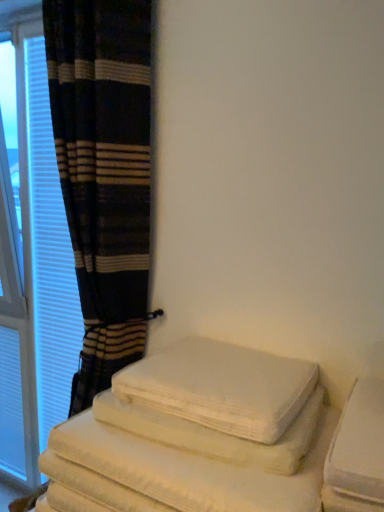
The height and width of the screenshot is (512, 384). I want to click on plaid fabric curtain at left, so click(x=104, y=173).

What is the approximate height of white cotton bath towel at lower right?

white cotton bath towel at lower right is 5.33 inches tall.

Locate an element on the screen. This screenshot has height=512, width=384. white soft towels at lower left is located at coordinates (216, 437).

Find the location of a particular element. This screenshot has width=384, height=512. white textured curtain at left is located at coordinates (34, 274).

Considering the relative positions of white soft towels at lower left and white textured curtain at left in the image provided, is white soft towels at lower left to the left or to the right of white textured curtain at left?

In the image, white soft towels at lower left appears on the right side of white textured curtain at left.

Which is more distant, (84, 443) or (34, 56)?

The point (34, 56) is farther from the camera.

Can we say white soft towels at lower left lies outside white textured curtain at left?

white soft towels at lower left is positioned outside white textured curtain at left.

Considering the relative positions of white soft towels at lower left and white textured curtain at left in the image provided, is white soft towels at lower left behind white textured curtain at left?

No, white soft towels at lower left is closer to the camera.

Considering the relative sizes of white cotton bath towel at lower right and white soft towels at lower left in the image provided, is white cotton bath towel at lower right smaller than white soft towels at lower left?

Correct, white cotton bath towel at lower right occupies less space than white soft towels at lower left.

Which point is more forward, (295,367) or (249,477)?

The point (249,477) is closer to the camera.

Visually, is white cotton bath towel at lower right positioned to the left or to the right of white soft towels at lower left?

From the image, it's evident that white cotton bath towel at lower right is to the right of white soft towels at lower left.

What's the angular difference between white textured curtain at left and white cotton bath towel at lower right's facing directions?

There is a 0.407-degree angle between the facing directions of white textured curtain at left and white cotton bath towel at lower right.

Relative to white cotton bath towel at lower right, is white textured curtain at left in front or behind?

Clearly, white textured curtain at left is behind white cotton bath towel at lower right.

From the image's perspective, does white textured curtain at left appear higher than white cotton bath towel at lower right?

Indeed, from the image's perspective, white textured curtain at left is shown above white cotton bath towel at lower right.

Is white textured curtain at left at the right side of white cotton bath towel at lower right?

In fact, white textured curtain at left is to the left of white cotton bath towel at lower right.

From the picture: Does white textured curtain at left have a greater width compared to plaid fabric curtain at left?

In fact, white textured curtain at left might be narrower than plaid fabric curtain at left.

From a real-world perspective, is white textured curtain at left located higher than plaid fabric curtain at left?

Yes, from a real-world perspective, white textured curtain at left is above plaid fabric curtain at left.

Who is shorter, white textured curtain at left or plaid fabric curtain at left?

Standing shorter between the two is plaid fabric curtain at left.

How much distance is there between white soft towels at lower left and plaid fabric curtain at left?

white soft towels at lower left is 22.80 inches away from plaid fabric curtain at left.

From the image's perspective, is white soft towels at lower left located above plaid fabric curtain at left?

Actually, white soft towels at lower left appears below plaid fabric curtain at left in the image.

Looking at this image, is white soft towels at lower left facing towards plaid fabric curtain at left?

No, white soft towels at lower left is not aimed at plaid fabric curtain at left.

Which of these two, white soft towels at lower left or plaid fabric curtain at left, stands shorter?

Standing shorter between the two is white soft towels at lower left.

From a real-world perspective, does white cotton bath towel at lower right stand above plaid fabric curtain at left?

Actually, white cotton bath towel at lower right is physically below plaid fabric curtain at left in the real world.

Are white cotton bath towel at lower right and plaid fabric curtain at left making contact?

No, white cotton bath towel at lower right is not in contact with plaid fabric curtain at left.

Looking at their sizes, would you say white cotton bath towel at lower right is wider or thinner than plaid fabric curtain at left?

Clearly, white cotton bath towel at lower right has less width compared to plaid fabric curtain at left.

Consider the image. How distant is white soft towels at lower left from white cotton bath towel at lower right?

They are 1.87 inches apart.

Is white soft towels at lower left looking in the opposite direction of white cotton bath towel at lower right?

No, white soft towels at lower left's orientation is not away from white cotton bath towel at lower right.

Is white soft towels at lower left at the right side of white cotton bath towel at lower right?

No, white soft towels at lower left is not to the right of white cotton bath towel at lower right.

Locate an element on the screen. The height and width of the screenshot is (512, 384). bath towel above the white soft towels at lower left (from the image's perspective) is located at coordinates (221, 387).

You are a GUI agent. You are given a task and a screenshot of the screen. Output one action in this format:
    pyautogui.click(x=<x>, y=<y>)
    Task: Click on the furniture below the white textured curtain at left (from the image's perspective)
    The image size is (384, 512).
    Given the screenshot: What is the action you would take?
    pyautogui.click(x=216, y=437)

This screenshot has height=512, width=384. In order to click on furniture located underneath the white cotton bath towel at lower right (from a real-world perspective) in this screenshot , I will do `click(216, 437)`.

When comparing their distances from white cotton bath towel at lower right, does white soft towels at lower left or white textured curtain at left seem further?

white textured curtain at left is positioned further to the anchor white cotton bath towel at lower right.

Based on their spatial positions, is white cotton bath towel at lower right or plaid fabric curtain at left further from white soft towels at lower left?

Among the two, plaid fabric curtain at left is located further to white soft towels at lower left.

When comparing their distances from white textured curtain at left, does white cotton bath towel at lower right or plaid fabric curtain at left seem further?

The object further to white textured curtain at left is white cotton bath towel at lower right.

Estimate the real-world distances between objects in this image. Which object is further from plaid fabric curtain at left, white soft towels at lower left or white textured curtain at left?

Among the two, white soft towels at lower left is located further to plaid fabric curtain at left.

Considering their positions, is white cotton bath towel at lower right positioned further to white textured curtain at left than white soft towels at lower left?

Among the two, white soft towels at lower left is located further to white textured curtain at left.

From the image, which object appears to be farther from white soft towels at lower left, plaid fabric curtain at left or white cotton bath towel at lower right?

plaid fabric curtain at left is positioned further to the anchor white soft towels at lower left.

When comparing their distances from white cotton bath towel at lower right, does white textured curtain at left or plaid fabric curtain at left seem further?

Based on the image, white textured curtain at left appears to be further to white cotton bath towel at lower right.

When comparing their distances from white textured curtain at left, does plaid fabric curtain at left or white cotton bath towel at lower right seem further?

The object further to white textured curtain at left is white cotton bath towel at lower right.

This screenshot has width=384, height=512. In order to click on furniture between white textured curtain at left and white cotton bath towel at lower right in the horizontal direction in this screenshot , I will do `click(216, 437)`.

Find the location of `curtain between white textured curtain at left and white soft towels at lower left in the horizontal direction`. curtain between white textured curtain at left and white soft towels at lower left in the horizontal direction is located at coordinates click(x=104, y=173).

Locate an element on the screen. This screenshot has height=512, width=384. curtain between white textured curtain at left and white cotton bath towel at lower right in the horizontal direction is located at coordinates (104, 173).

Find the location of `furniture located between plaid fabric curtain at left and white cotton bath towel at lower right in the left-right direction`. furniture located between plaid fabric curtain at left and white cotton bath towel at lower right in the left-right direction is located at coordinates (216, 437).